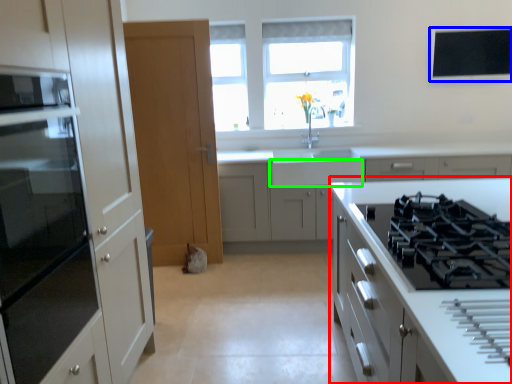
Question: Based on their relative distances, which object is farther from cabinetry (highlighted by a red box)? Choose from window screen (highlighted by a blue box) and drawer (highlighted by a green box).

Choices:
 (A) window screen
 (B) drawer

Answer: (A)